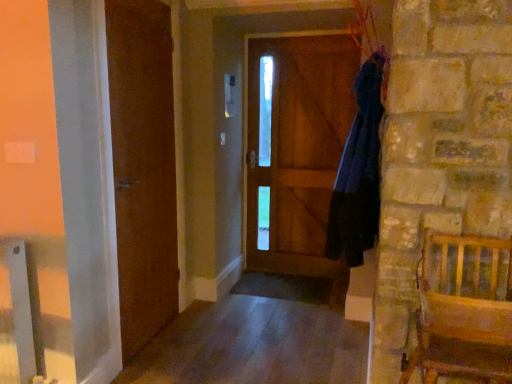
Question: Is wooden chair at right to the left of smooth wood floor at lower center from the viewer's perspective?

Choices:
 (A) yes
 (B) no

Answer: (B)

Question: From a real-world perspective, does wooden chair at right sit lower than smooth wood floor at lower center?

Choices:
 (A) yes
 (B) no

Answer: (B)

Question: Would you say wooden chair at right is outside smooth wood floor at lower center?

Choices:
 (A) no
 (B) yes

Answer: (B)

Question: Can you confirm if wooden chair at right is thinner than smooth wood floor at lower center?

Choices:
 (A) no
 (B) yes

Answer: (B)

Question: Would you say wooden chair at right is a long distance from smooth wood floor at lower center?

Choices:
 (A) no
 (B) yes

Answer: (B)

Question: From a real-world perspective, is smooth wood floor at lower center physically located above or below dark blue fabric at right?

Choices:
 (A) above
 (B) below

Answer: (B)

Question: Looking at their shapes, would you say smooth wood floor at lower center is wider or thinner than dark blue fabric at right?

Choices:
 (A) wide
 (B) thin

Answer: (A)

Question: Considering the positions of smooth wood floor at lower center and dark blue fabric at right in the image, is smooth wood floor at lower center bigger or smaller than dark blue fabric at right?

Choices:
 (A) small
 (B) big

Answer: (B)

Question: From the image's perspective, is smooth wood floor at lower center above or below dark blue fabric at right?

Choices:
 (A) below
 (B) above

Answer: (A)

Question: From a real-world perspective, relative to dark blue fabric at right, is brown wooden door at left vertically above or below?

Choices:
 (A) above
 (B) below

Answer: (B)

Question: Looking at the image, does brown wooden door at left seem bigger or smaller compared to dark blue fabric at right?

Choices:
 (A) small
 (B) big

Answer: (A)

Question: Considering the positions of brown wooden door at left and dark blue fabric at right in the image, is brown wooden door at left taller or shorter than dark blue fabric at right?

Choices:
 (A) tall
 (B) short

Answer: (A)

Question: From the image's perspective, is brown wooden door at left positioned above or below dark blue fabric at right?

Choices:
 (A) above
 (B) below

Answer: (B)

Question: From the image's perspective, is smooth wood floor at lower center above or below brown wooden door at left?

Choices:
 (A) above
 (B) below

Answer: (B)

Question: From a real-world perspective, is smooth wood floor at lower center above or below brown wooden door at left?

Choices:
 (A) above
 (B) below

Answer: (B)